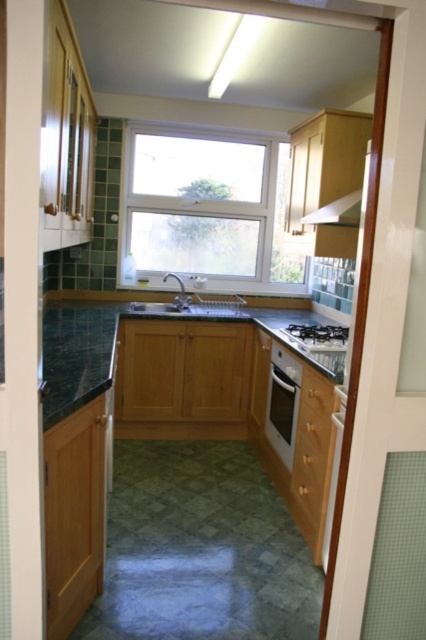
Which is above, clear glass window at center or satin silver oven at center?

clear glass window at center is above.

Is point (178, 220) positioned behind point (270, 360)?

Yes.

Identify the location of clear glass window at center. (206, 209).

Who is more distant from viewer, [270,369] or [198,305]?

The point [198,305] is more distant.

Does satin silver oven at center have a lesser width compared to satin silver sink at center?

Indeed, satin silver oven at center has a lesser width compared to satin silver sink at center.

Based on the photo, measure the distance between point [281,358] and camera.

Point [281,358] is 3.10 meters away from camera.

The width and height of the screenshot is (426, 640). Identify the location of satin silver oven at center. (282, 403).

Between matte wood exhaust hood at upper right and black matte gas stove at center, which one appears on the left side from the viewer's perspective?

black matte gas stove at center

Is matte wood exhaust hood at upper right taller than black matte gas stove at center?

Indeed, matte wood exhaust hood at upper right has a greater height compared to black matte gas stove at center.

Is point (365, 164) more distant than point (298, 332)?

No, (365, 164) is closer to viewer.

Find the location of `matte wood exhaust hood at upper right`. matte wood exhaust hood at upper right is located at coordinates (342, 204).